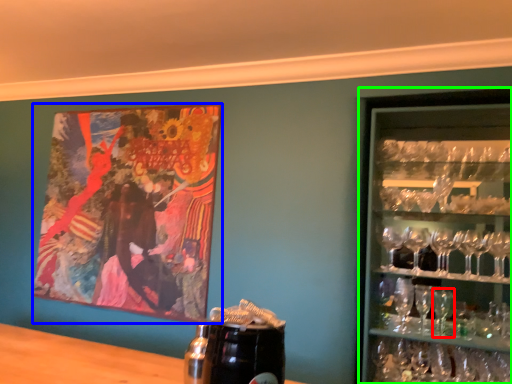
Question: Considering the real-world distances, which object is closest to martini glass (highlighted by a red box)? picture frame (highlighted by a blue box) or shelf (highlighted by a green box).

Choices:
 (A) picture frame
 (B) shelf

Answer: (B)